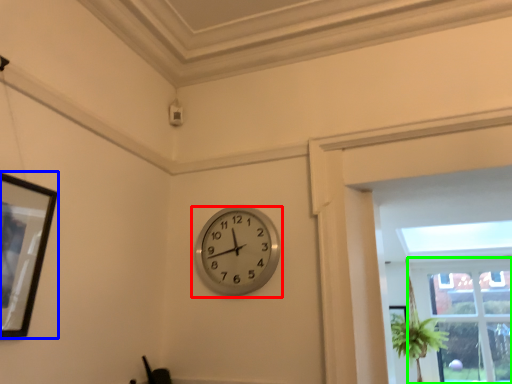
Question: Considering the real-world distances, which object is farthest from wall clock (highlighted by a red box)? picture frame (highlighted by a blue box) or window (highlighted by a green box)?

Choices:
 (A) picture frame
 (B) window

Answer: (B)